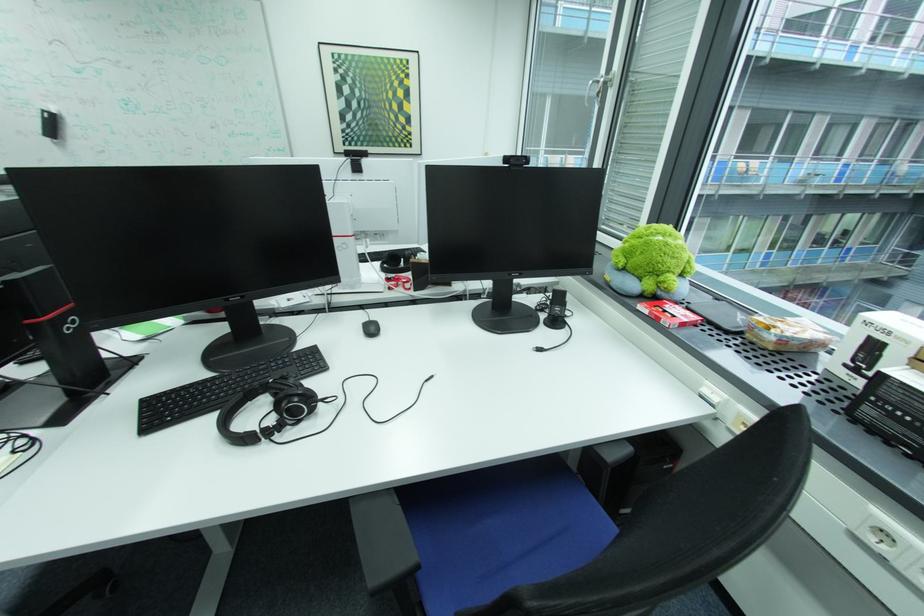
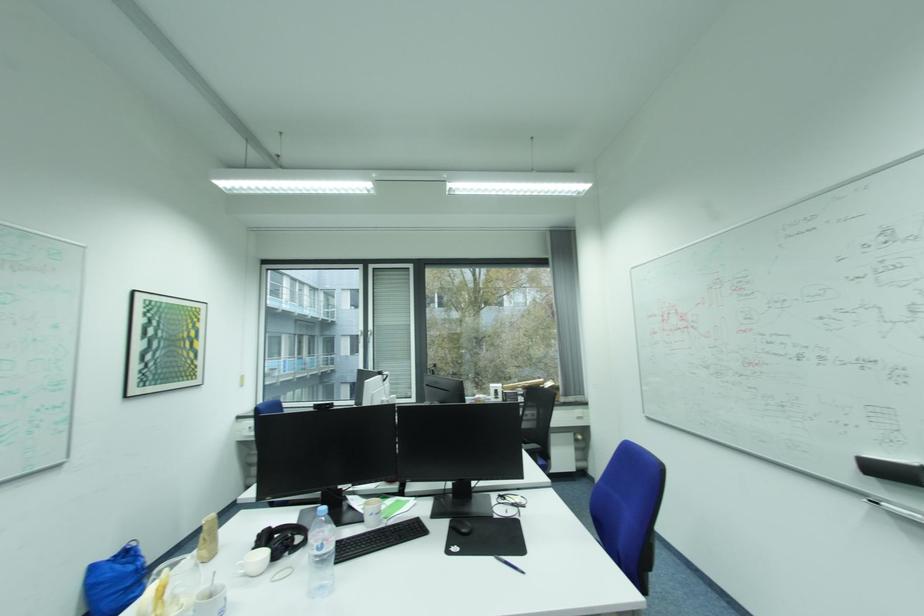
Question: I am providing you with two images of the same scene from different viewpoints. Which of the following objects are not visible in image2?

Choices:
 (A) black whiteboard eraser
 (B) black keyboard
 (C) treadmill handle
 (D) black computer mouse

Answer: (D)